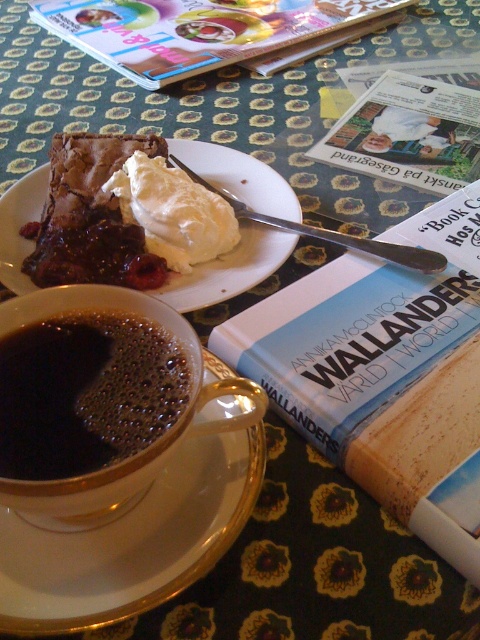
You are organizing a small reading nook and need to place both the hardcover book at center and the matte paper magazine at upper center on a shelf. If the shelf has limited space, which item should you prioritize placing first to ensure both fit?

The hardcover book at center might be wider than the matte paper magazine at upper center, so you should prioritize placing the matte paper magazine at upper center first to accommodate the wider book.

You are a drone operator trying to capture a closeup shot of the table. The camera is currently positioned 15 inches away from the table. If you move the camera forward by 1.13 inches, will the point at coordinates point [357,352] come into focus?

The distance of point [357,352] from camera is 13.87 inches. After moving the camera forward by 1.13 inches, the new distance becomes 15 inches minus 1.13 inches equals 13.87 inches. Therefore, the point at point [357,352] will now be in focus because the camera is now exactly at the correct distance.

You are standing at a distance of 16.87 inches from the point labeled as point [443,243] on the table. If you want to reach this point without moving your feet, can you extend your arm to touch it?

The point labeled as point [443,243] is 16.87 inches away from you. The average human arm length is approximately 25 to 30 inches, so yes, you can extend your arm to touch the point labeled as point [443,243] without moving your feet.